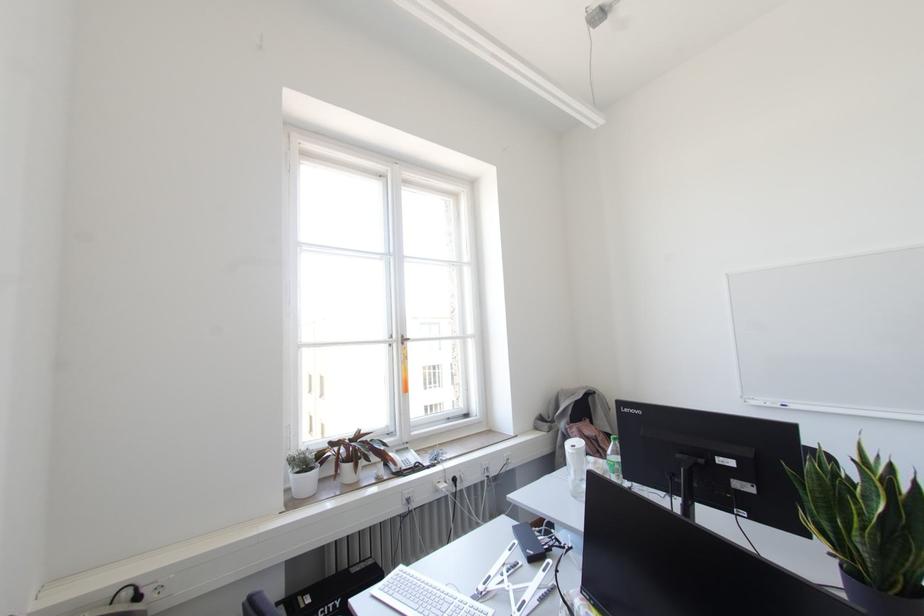
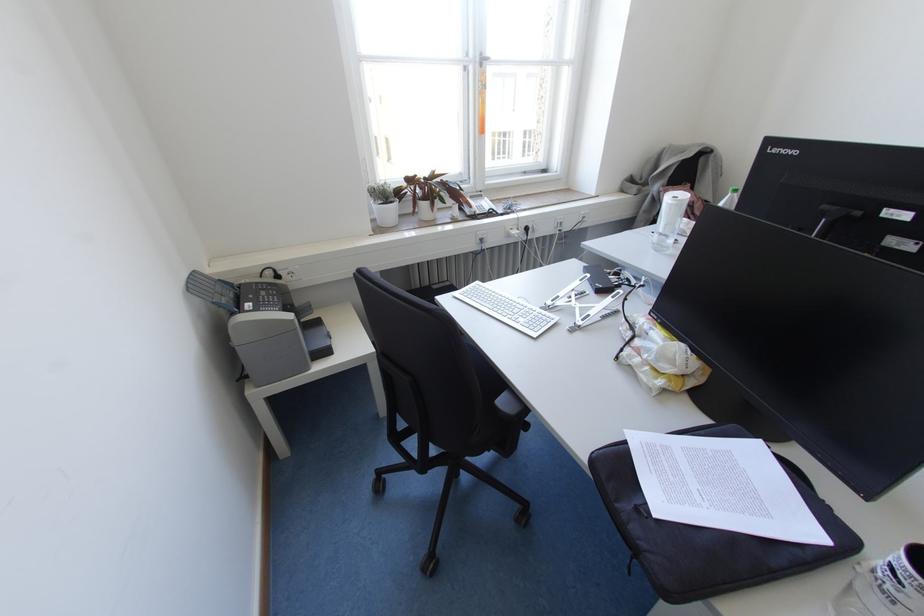
Find the pixel in the second image that matches the point at 417,464 in the first image.

(490, 209)